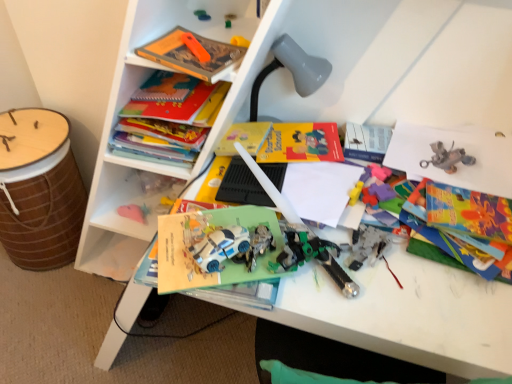
Question: Is rubberized plastic puzzle pieces at center, the 4th toy when ordered from left to right, thinner than green plastic toy at center, which appears as the second toy when viewed from the right?

Choices:
 (A) yes
 (B) no

Answer: (B)

Question: Are rubberized plastic puzzle pieces at center, the first toy when ordered from bottom to top, and green plastic toy at center, marked as the 3th toy in a bottom-to-top arrangement, beside each other?

Choices:
 (A) yes
 (B) no

Answer: (B)

Question: Can you confirm if rubberized plastic puzzle pieces at center, which ranks as the first toy in right-to-left order, is smaller than green plastic toy at center, which appears as the second toy when viewed from the right?

Choices:
 (A) no
 (B) yes

Answer: (A)

Question: From a real-world perspective, does rubberized plastic puzzle pieces at center, the first toy when ordered from bottom to top, sit lower than green plastic toy at center, marked as the 3th toy in a bottom-to-top arrangement?

Choices:
 (A) yes
 (B) no

Answer: (A)

Question: Is rubberized plastic puzzle pieces at center, the 4th toy when ordered from left to right, taller than green plastic toy at center, which appears as the second toy when viewed from the right?

Choices:
 (A) no
 (B) yes

Answer: (B)

Question: From a real-world perspective, is hardcover book at upper left, which is the 1th book from back to front, above or below gray matte lamp at upper center?

Choices:
 (A) below
 (B) above

Answer: (A)

Question: Considering the positions of hardcover book at upper left, which is the 1th book from back to front, and gray matte lamp at upper center in the image, is hardcover book at upper left, which is the 1th book from back to front, bigger or smaller than gray matte lamp at upper center?

Choices:
 (A) big
 (B) small

Answer: (A)

Question: Relative to gray matte lamp at upper center, is hardcover book at upper left, which is the 1th book from back to front, in front or behind?

Choices:
 (A) behind
 (B) front

Answer: (B)

Question: Considering the positions of point (113, 145) and point (279, 49), is point (113, 145) closer or farther from the camera than point (279, 49)?

Choices:
 (A) farther
 (B) closer

Answer: (A)

Question: From the image's perspective, is rubberized plastic puzzle pieces at center, which ranks as the first toy in right-to-left order, above or below hardcover book at upper left, which appears as the 2th book when viewed from the front?

Choices:
 (A) below
 (B) above

Answer: (A)

Question: In terms of width, does rubberized plastic puzzle pieces at center, which ranks as the first toy in right-to-left order, look wider or thinner when compared to hardcover book at upper left, which is the 1th book from back to front?

Choices:
 (A) thin
 (B) wide

Answer: (A)

Question: Is rubberized plastic puzzle pieces at center, which ranks as the fourth toy in top-to-bottom order, situated inside hardcover book at upper left, which is the 1th book from back to front, or outside?

Choices:
 (A) outside
 (B) inside

Answer: (A)

Question: From a real-world perspective, is rubberized plastic puzzle pieces at center, which ranks as the fourth toy in top-to-bottom order, above or below hardcover book at upper left, which is the 1th book from back to front?

Choices:
 (A) above
 (B) below

Answer: (B)

Question: Is point (202, 13) positioned closer to the camera than point (264, 67)?

Choices:
 (A) farther
 (B) closer

Answer: (B)

Question: Would you say matte plastic toy at upper center, the 1th toy from the top, is to the left or to the right of gray matte lamp at upper center in the picture?

Choices:
 (A) right
 (B) left

Answer: (B)